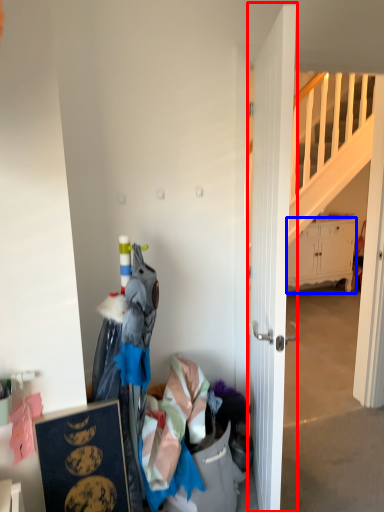
Question: Which object is closer to the camera taking this photo, door (highlighted by a red box) or cabinetry (highlighted by a blue box)?

Choices:
 (A) door
 (B) cabinetry

Answer: (A)